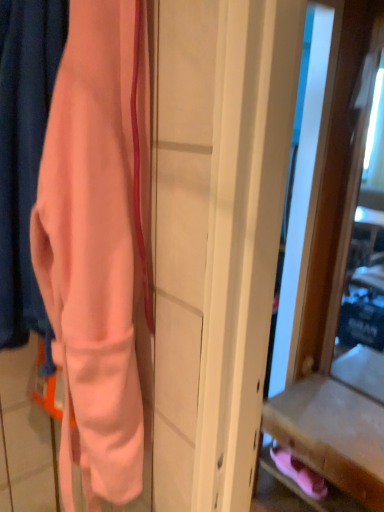
Question: Does point (311, 479) appear closer or farther from the camera than point (0, 233)?

Choices:
 (A) closer
 (B) farther

Answer: (B)

Question: From their relative heights in the image, would you say pink suede shoes at lower right is taller or shorter than matte peach fabric at left?

Choices:
 (A) tall
 (B) short

Answer: (B)

Question: Which of these objects is positioned farthest from the matte peach fabric at left?

Choices:
 (A) pink suede shoes at lower right
 (B) wooden drawer at lower right

Answer: (A)

Question: Which of these objects is positioned closest to the matte peach fabric at left?

Choices:
 (A) pink suede shoes at lower right
 (B) wooden drawer at lower right

Answer: (B)